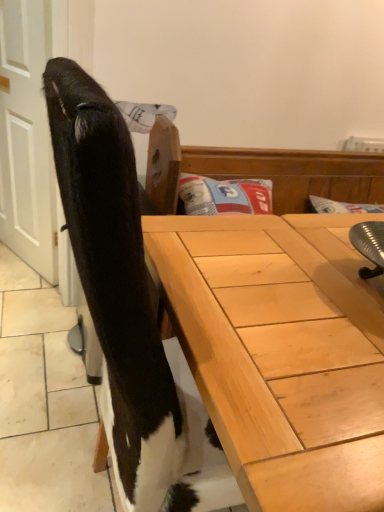
Question: Does black matte screen door at left have a lesser height compared to light wood desk at lower right?

Choices:
 (A) yes
 (B) no

Answer: (B)

Question: Does black matte screen door at left have a larger size compared to light wood desk at lower right?

Choices:
 (A) no
 (B) yes

Answer: (A)

Question: From the image's perspective, would you say black matte screen door at left is positioned over light wood desk at lower right?

Choices:
 (A) yes
 (B) no

Answer: (A)

Question: Considering the relative positions of black matte screen door at left and light wood desk at lower right in the image provided, is black matte screen door at left behind light wood desk at lower right?

Choices:
 (A) yes
 (B) no

Answer: (A)

Question: Is the depth of black matte screen door at left less than that of light wood desk at lower right?

Choices:
 (A) yes
 (B) no

Answer: (B)

Question: Does black matte screen door at left have a smaller size compared to light wood desk at lower right?

Choices:
 (A) yes
 (B) no

Answer: (A)

Question: Considering the relative sizes of light wood desk at lower right and black matte screen door at left in the image provided, is light wood desk at lower right bigger than black matte screen door at left?

Choices:
 (A) no
 (B) yes

Answer: (B)

Question: Is light wood desk at lower right oriented towards black matte screen door at left?

Choices:
 (A) yes
 (B) no

Answer: (B)

Question: Can you confirm if light wood desk at lower right is wider than black matte screen door at left?

Choices:
 (A) no
 (B) yes

Answer: (B)

Question: Would you say light wood desk at lower right is a long distance from black matte screen door at left?

Choices:
 (A) no
 (B) yes

Answer: (B)

Question: Is light wood desk at lower right shorter than black matte screen door at left?

Choices:
 (A) yes
 (B) no

Answer: (A)

Question: Does light wood desk at lower right appear on the left side of black matte screen door at left?

Choices:
 (A) yes
 (B) no

Answer: (B)

Question: From a real-world perspective, relative to light wood desk at lower right, is black matte screen door at left vertically above or below?

Choices:
 (A) below
 (B) above

Answer: (B)